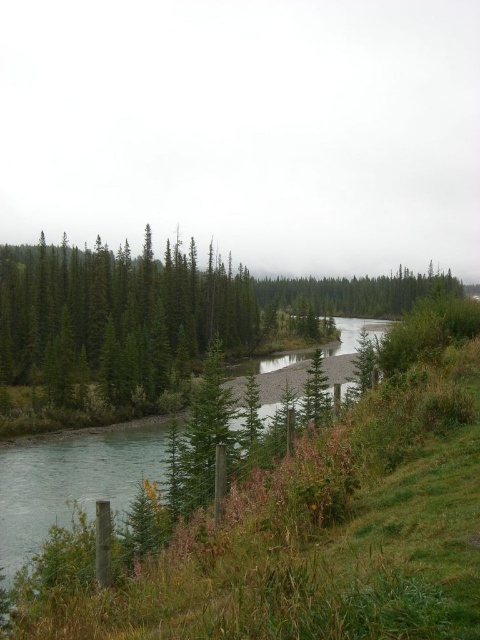
Question: Is green matte tree at center-left positioned before green matte trees at center?

Choices:
 (A) yes
 (B) no

Answer: (B)

Question: Estimate the real-world distances between objects in this image. Which object is closer to the green smooth river at center?

Choices:
 (A) green matte tree at center-left
 (B) green matte trees at center

Answer: (A)

Question: Can you confirm if green matte tree at center-left is positioned to the left of green matte trees at center?

Choices:
 (A) yes
 (B) no

Answer: (A)

Question: Does green matte tree at center-left have a lesser width compared to green smooth river at center?

Choices:
 (A) no
 (B) yes

Answer: (B)

Question: Which object appears farthest from the camera in this image?

Choices:
 (A) green matte tree at center-left
 (B) green smooth river at center
 (C) green matte trees at center

Answer: (A)

Question: Which object is farther from the camera taking this photo?

Choices:
 (A) green smooth river at center
 (B) green matte tree at center-left

Answer: (B)